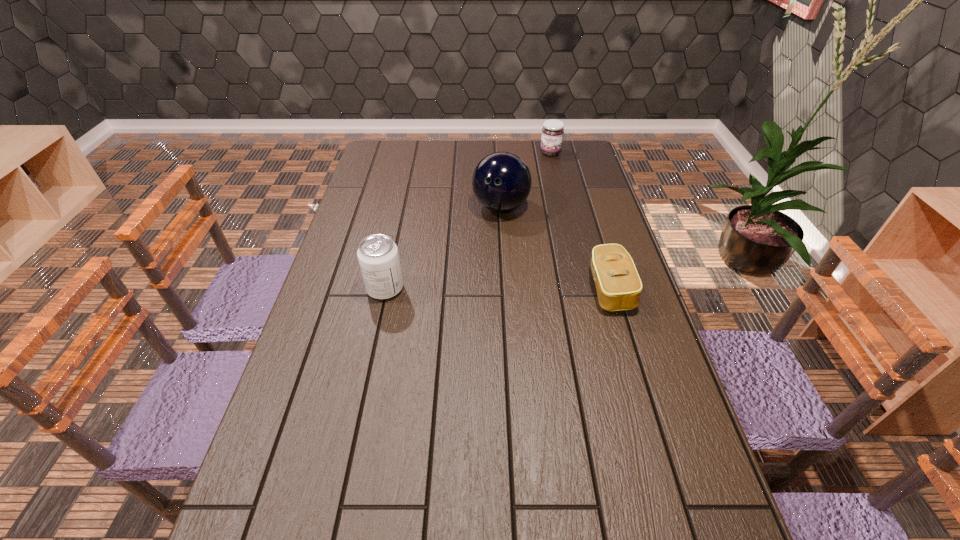
The image size is (960, 540). I want to click on free space located on the front label of the farthest object, so click(540, 189).

Find the location of `vacant region located on the side of the second object from left to right with the finger holes`. vacant region located on the side of the second object from left to right with the finger holes is located at coordinates (491, 241).

I want to click on vacant space positioned on the side of the second object from left to right with the finger holes, so click(x=482, y=267).

Where is `vacant position located 0.060m on the side of the second object from left to right with the finger holes`? vacant position located 0.060m on the side of the second object from left to right with the finger holes is located at coordinates (492, 235).

Identify the location of object that is positioned at the far edge. (553, 130).

The width and height of the screenshot is (960, 540). Identify the location of object that is at the left edge. (378, 257).

Locate an element on the screen. clutch bag located at the right edge is located at coordinates (618, 285).

Where is `jam situated at the right edge`? This screenshot has height=540, width=960. jam situated at the right edge is located at coordinates (553, 130).

This screenshot has width=960, height=540. I want to click on object that is positioned at the far right corner, so click(553, 130).

Locate an element on the screen. free region at the far edge of the desktop is located at coordinates (469, 160).